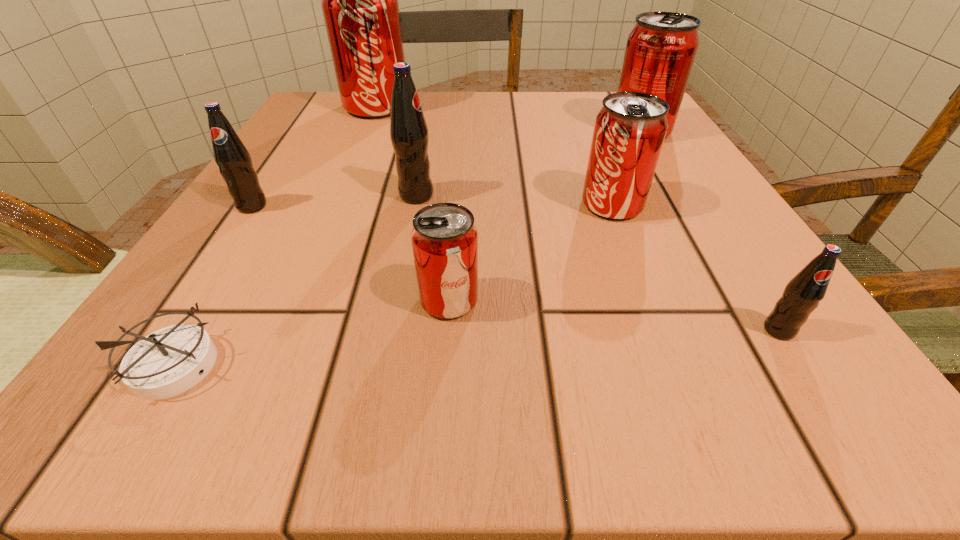
The height and width of the screenshot is (540, 960). Identify the location of free space at the right edge of the desktop. (732, 232).

Locate an element on the screen. vacant space at the far left corner of the desktop is located at coordinates (340, 133).

This screenshot has width=960, height=540. In the image, there is a desktop. In order to click on vacant space at the far right corner in this screenshot , I will do `click(598, 99)`.

Image resolution: width=960 pixels, height=540 pixels. In order to click on free area in between the third pop from right to left and the tallest object in this screenshot , I will do `click(494, 156)`.

The height and width of the screenshot is (540, 960). What are the coordinates of `empty space between the biggest black pop and the leftmost pop` in the screenshot? It's located at (334, 201).

The width and height of the screenshot is (960, 540). What are the coordinates of `blank region between the third pop from right to left and the tallest object` in the screenshot? It's located at (494, 156).

This screenshot has width=960, height=540. Find the location of `free spot between the tallest pop and the leftmost pop`. free spot between the tallest pop and the leftmost pop is located at coordinates (314, 157).

What are the coordinates of `empty space between the leftmost black pop and the shortest object` in the screenshot? It's located at (214, 285).

The width and height of the screenshot is (960, 540). Find the location of `vacant area between the fifth pop from left to right and the biggest black pop`. vacant area between the fifth pop from left to right and the biggest black pop is located at coordinates (515, 200).

Find the location of `vacant space that's between the rightmost red pop soda and the tallest pop`. vacant space that's between the rightmost red pop soda and the tallest pop is located at coordinates (508, 119).